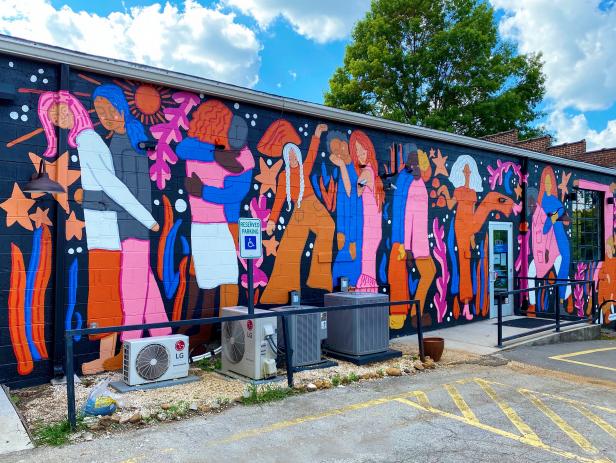
Where is `dark blue wall with people painted dancing`? dark blue wall with people painted dancing is located at coordinates (18, 73), (26, 165), (5, 368), (176, 216), (306, 264), (451, 149), (480, 157), (514, 228).